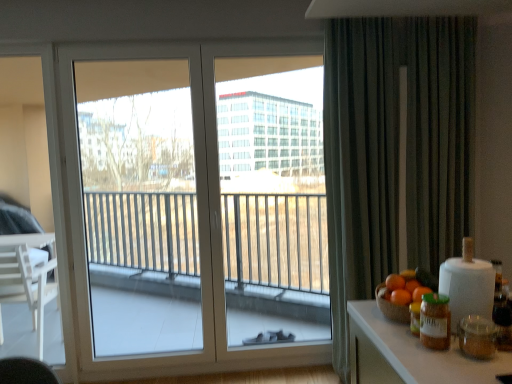
This screenshot has height=384, width=512. Describe the element at coordinates (435, 322) in the screenshot. I see `green matte jar at right` at that location.

This screenshot has height=384, width=512. I want to click on transparent glass window at left, so click(x=140, y=205).

In order to face dark grey textured curtain at right, should I rotate leftwards or rightwards?

Rotate your view right by about 19.952°.

The image size is (512, 384). What do you see at coordinates (196, 206) in the screenshot? I see `white glass window at center` at bounding box center [196, 206].

Identify the location of orange matte at right, acting as the second orange starting from the back. click(x=404, y=288).

I want to click on orange matte at right, marked as the third orange in a back-to-front arrangement, so click(x=400, y=297).

The width and height of the screenshot is (512, 384). In order to click on green matte jar at right in this screenshot , I will do `click(435, 322)`.

Between point (404, 294) and point (403, 290), which one is positioned in front?

The point (404, 294) is more forward.

From a real-world perspective, is orange matte at right, the 2th orange in the front-to-back sequence, positioned above or below orange matte at right, which is the 1th orange in front-to-back order?

In terms of real-world spatial position, orange matte at right, the 2th orange in the front-to-back sequence, is above orange matte at right, which is the 1th orange in front-to-back order.

Relative to orange matte at right, marked as the third orange in a back-to-front arrangement, is orange matte at right, acting as the second orange starting from the back, in front or behind?

orange matte at right, acting as the second orange starting from the back, is behind orange matte at right, marked as the third orange in a back-to-front arrangement.

This screenshot has width=512, height=384. I want to click on window screen on the left of the white glass window at center, so click(140, 205).

Which object is wider, white glass window at center or transparent glass window at left?

Wider between the two is white glass window at center.

Which is closer to the camera, (257, 292) or (105, 249)?

The point (257, 292) is closer to the camera.

Between white glass window at center and transparent glass window at left, which one has more height?

With more height is white glass window at center.

Is there a large distance between transparent glass window at left and dark grey textured curtain at right?

Yes.

Is transparent glass window at left completely or partially outside of dark grey textured curtain at right?

Yes, transparent glass window at left is outside of dark grey textured curtain at right.

Measure the distance from transparent glass window at left to dark grey textured curtain at right.

transparent glass window at left and dark grey textured curtain at right are 2.14 meters apart.

Consider the image. From the image's perspective, is transparent glass window at left over dark grey textured curtain at right?

Actually, transparent glass window at left appears below dark grey textured curtain at right in the image.

How different are the orientations of orange matte at right, marked as the third orange in a back-to-front arrangement, and orange matte at right, acting as the second orange starting from the back, in degrees?

The angle between the facing direction of orange matte at right, marked as the third orange in a back-to-front arrangement, and the facing direction of orange matte at right, acting as the second orange starting from the back, is 180 degrees.

At what (x,y) coordinates should I click in order to perform the action: click on the 2nd orange above the orange matte at right, marked as the third orange in a back-to-front arrangement (from a real-world perspective). Please return your answer as a coordinate pair (x, y). The image size is (512, 384). Looking at the image, I should click on (404, 288).

Is orange matte at right, which is the 1th orange in front-to-back order, wider or thinner than orange matte at right, acting as the second orange starting from the back?

orange matte at right, which is the 1th orange in front-to-back order, is thinner than orange matte at right, acting as the second orange starting from the back.

Is the surface of orange matte at right, marked as the third orange in a back-to-front arrangement, in direct contact with orange matte at right, the 2th orange in the front-to-back sequence?

Yes, orange matte at right, marked as the third orange in a back-to-front arrangement, is touching orange matte at right, the 2th orange in the front-to-back sequence.

Can you tell me how much orange matte at right, marked as the third orange in a back-to-front arrangement, and white glass window at center differ in facing direction?

The angle between the facing direction of orange matte at right, marked as the third orange in a back-to-front arrangement, and the facing direction of white glass window at center is 91.4 degrees.

Which object is further away from the camera taking this photo, orange matte at right, marked as the third orange in a back-to-front arrangement, or white glass window at center?

white glass window at center is behind.

Considering the sizes of objects orange matte at right, which is the 1th orange in front-to-back order, and white glass window at center in the image provided, who is thinner, orange matte at right, which is the 1th orange in front-to-back order, or white glass window at center?

Thinner between the two is orange matte at right, which is the 1th orange in front-to-back order.

Can white glass window at center be found inside orange matte at right, which is the 1th orange in front-to-back order?

No, orange matte at right, which is the 1th orange in front-to-back order, does not contain white glass window at center.

From a real-world perspective, is orange matte at right, the 2th orange in the front-to-back sequence, positioned over white glass window at center based on gravity?

Actually, orange matte at right, the 2th orange in the front-to-back sequence, is physically below white glass window at center in the real world.

In the scene shown: Is orange matte at right, acting as the second orange starting from the back, in contact with white glass window at center?

There is a gap between orange matte at right, acting as the second orange starting from the back, and white glass window at center.

Based on the photo, can you tell me how much orange matte at right, the 2th orange in the front-to-back sequence, and white glass window at center differ in facing direction?

88.6 degrees separate the facing orientations of orange matte at right, the 2th orange in the front-to-back sequence, and white glass window at center.

Does orange matte at right, acting as the second orange starting from the back, turn towards white glass window at center?

No, orange matte at right, acting as the second orange starting from the back, is not aimed at white glass window at center.

Identify the location of window screen on the left of dark grey textured curtain at right. (140, 205).

Is dark grey textured curtain at right inside or outside of transparent glass window at left?

The correct answer is: outside.

From a real-world perspective, is dark grey textured curtain at right positioned over transparent glass window at left based on gravity?

Indeed, from a real-world perspective, dark grey textured curtain at right stands above transparent glass window at left.

Where is `orange that is in front of the orange matte at right, acting as the second orange starting from the back`? Image resolution: width=512 pixels, height=384 pixels. orange that is in front of the orange matte at right, acting as the second orange starting from the back is located at coordinates (400, 297).

Image resolution: width=512 pixels, height=384 pixels. I want to click on window on the right of transparent glass window at left, so click(x=196, y=206).

Consider the image. From the image, which object appears to be farther from green matte jar at right, orange matte at right, acting as the second orange starting from the back, or transparent glass window at left?

transparent glass window at left is positioned further to the anchor green matte jar at right.

Estimate the real-world distances between objects in this image. Which object is closer to transparent glass window at left, green matte jar at right or orange matte at right, the 3th orange positioned from the front?

orange matte at right, the 3th orange positioned from the front.

Which object lies further to the anchor point green matte jar at right, dark grey textured curtain at right or orange matte at right, the 2th orange in the front-to-back sequence?

Based on the image, dark grey textured curtain at right appears to be further to green matte jar at right.

Looking at this image, from the image, which object appears to be farther from dark grey textured curtain at right, white glass window at center or transparent glass window at left?

transparent glass window at left is further to dark grey textured curtain at right.

From the image, which object appears to be nearer to green matte jar at right, orange matte at right, which is the 1th orange in front-to-back order, or dark grey textured curtain at right?

Based on the image, orange matte at right, which is the 1th orange in front-to-back order, appears to be nearer to green matte jar at right.

Based on their spatial positions, is green matte jar at right or orange matte at right, which is the 1th orange in front-to-back order, further from orange matte at right, the 3th orange positioned from the front?

green matte jar at right is positioned further to the anchor orange matte at right, the 3th orange positioned from the front.

Based on their spatial positions, is green matte jar at right or orange matte at right, marked as the third orange in a back-to-front arrangement, closer to transparent glass window at left?

orange matte at right, marked as the third orange in a back-to-front arrangement.

Looking at this image, which object lies nearer to the anchor point dark grey textured curtain at right, orange matte at right, the 3th orange positioned from the front, or orange matte at right, marked as the third orange in a back-to-front arrangement?

orange matte at right, the 3th orange positioned from the front.

Locate an element on the screen. This screenshot has width=512, height=384. orange positioned between green matte jar at right and orange matte at right, acting as the second orange starting from the back, from near to far is located at coordinates (400, 297).

You are a GUI agent. You are given a task and a screenshot of the screen. Output one action in this format:
    pyautogui.click(x=<x>, y=<y>)
    Task: Click on the beverage situated between transparent glass window at left and dark grey textured curtain at right from left to right
    
    Given the screenshot: What is the action you would take?
    pyautogui.click(x=435, y=322)

Where is `window between transparent glass window at left and orange matte at right, positioned as the 1th orange in back-to-front order, from left to right`? The width and height of the screenshot is (512, 384). window between transparent glass window at left and orange matte at right, positioned as the 1th orange in back-to-front order, from left to right is located at coordinates (196, 206).

The width and height of the screenshot is (512, 384). What are the coordinates of `window between orange matte at right, which is the 1th orange in front-to-back order, and transparent glass window at left from front to back` in the screenshot? It's located at (196, 206).